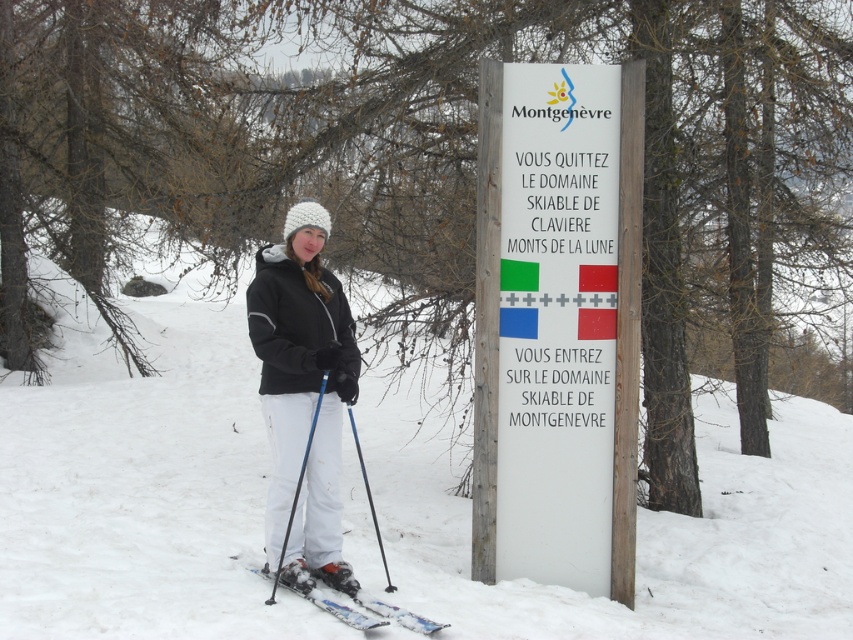
You are standing at the point labeled point (x=299, y=577) and want to walk to the point labeled point (x=323, y=381). Given that you can only move forward in a straight line, will you be able to reach the second point without changing direction?

Yes, because point (x=299, y=577) is closer to you than point (x=323, y=381), so moving forward in a straight line will take you directly to the second point.

What is the exact location of the white powder snow at center in the image?

The white powder snow at center is located at point (141, 484).

You are a winter sports instructor preparing to teach a beginner class. You have a white plastic ski at lower center and a blue plastic ski pole at lower center. Which object is wider?

The white plastic ski at lower center is wider than the blue plastic ski pole at lower center.